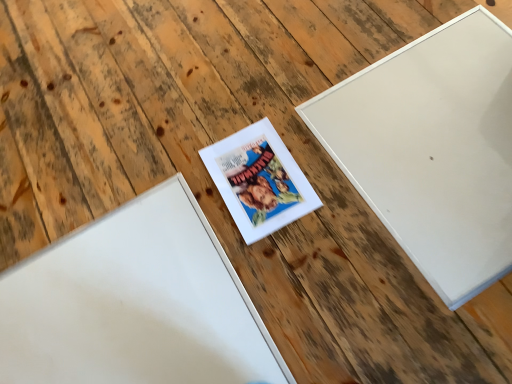
This screenshot has width=512, height=384. What are the coordinates of `vacant region in front of white matte picture frame at center, which is the second picture frame from left to right` in the screenshot? It's located at (291, 271).